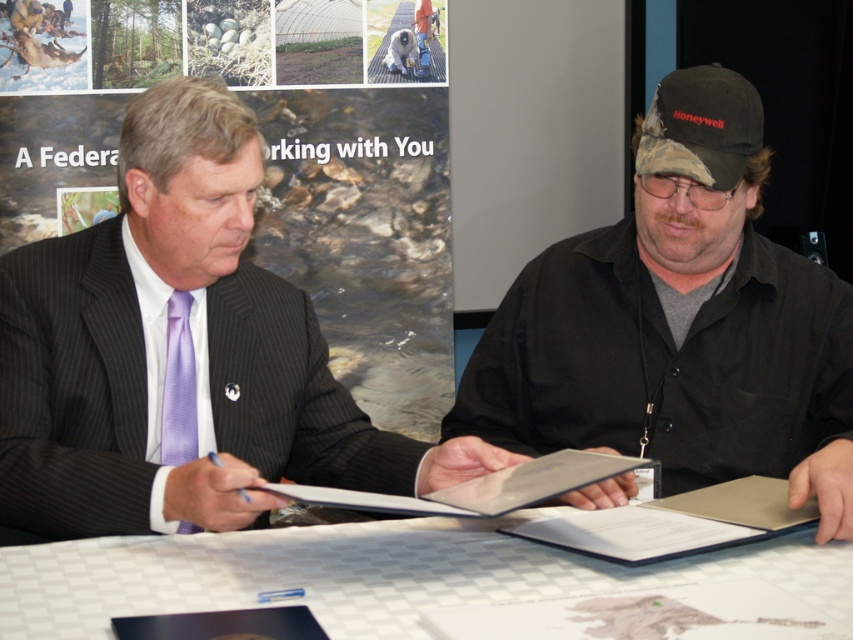
Question: Based on their relative distances, which object is nearer to the beige leather book at center?

Choices:
 (A) black matte shirt at center
 (B) white checkered table at center

Answer: (B)

Question: Is matte black suit at left bigger than white checkered table at center?

Choices:
 (A) no
 (B) yes

Answer: (B)

Question: Which object appears farthest from the camera in this image?

Choices:
 (A) black fabric baseball cap at center
 (B) matte black suit at center
 (C) white checkered table at center
 (D) matte black suit at left

Answer: (A)

Question: Does white checkered table at center appear over white paper at center?

Choices:
 (A) yes
 (B) no

Answer: (B)

Question: Among these points, which one is nearest to the camera?

Choices:
 (A) tap(351, 492)
 (B) tap(216, 228)

Answer: (A)

Question: Is beige leather book at center positioned at the back of black fabric baseball cap at center?

Choices:
 (A) no
 (B) yes

Answer: (A)